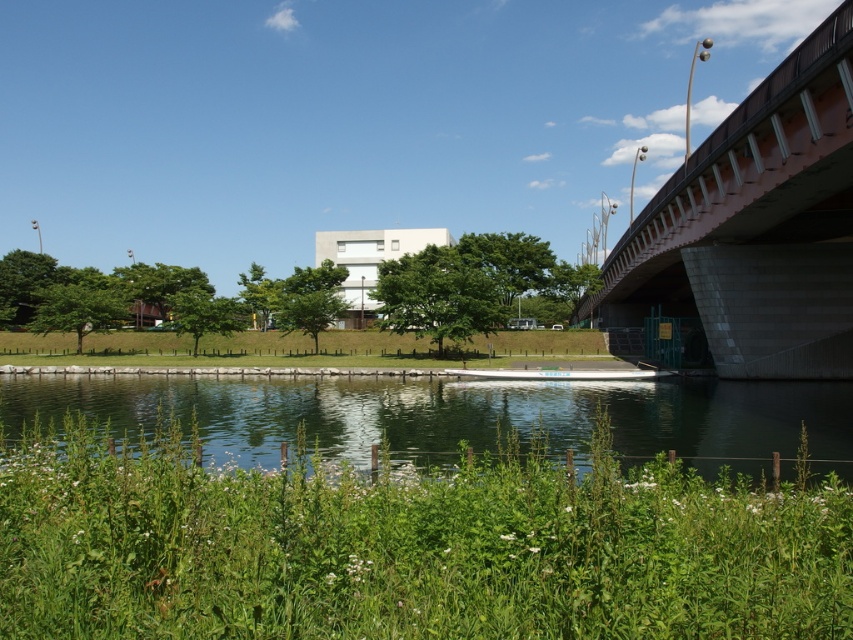
You are standing at the point with coordinates (757, 225) in the image. Based on the scene description, what object are you most likely standing on?

The point at coordinates (757, 225) indicates the concrete bridge at right, so you are most likely standing on the concrete bridge at right.

You are standing at the edge of the waterway in the image. There is a point marked at coordinates (459, 417). What is located at that point?

The point at coordinates (459, 417) marks the location of transparent water at center.

You are standing at the edge of the waterway and want to cross to the other side. You see a concrete bridge at right and green grass at center. Which path should you choose to reach the other side without getting wet?

You should choose the concrete bridge at right because it is closer to the viewer than the green grass at center, making it the accessible path to cross without getting wet.